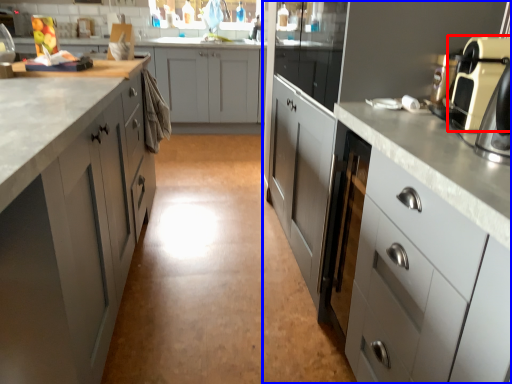
Question: Which of the following is the closest to the observer, home appliance (highlighted by a red box) or cabinetry (highlighted by a blue box)?

Choices:
 (A) home appliance
 (B) cabinetry

Answer: (A)